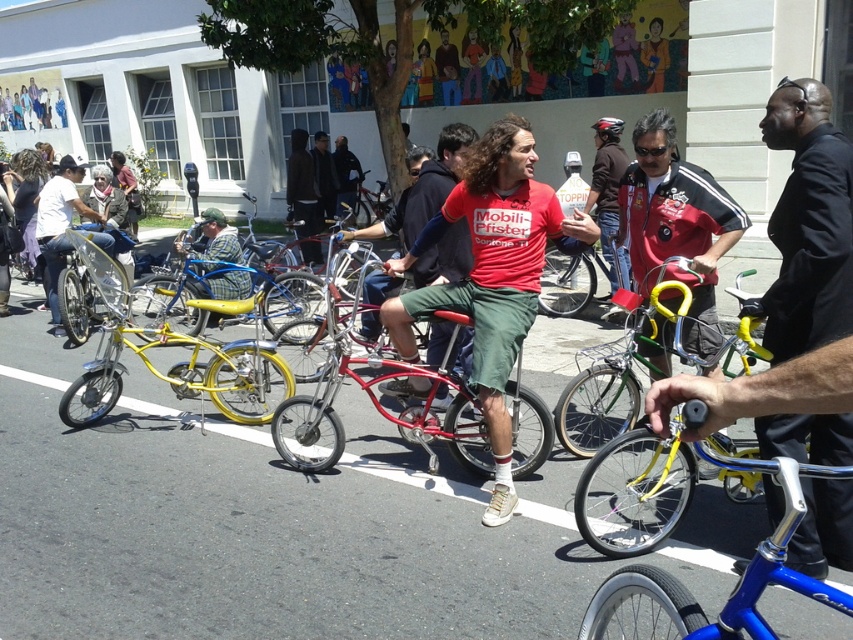
Question: Which of the following is the closest to the observer?

Choices:
 (A) blue metallic bicycle at center
 (B) matte yellow bicycle at left

Answer: (A)

Question: Which object is positioned farthest from the matte red t-shirt at center?

Choices:
 (A) blue metallic bicycle at center
 (B) shiny red bicycle at center
 (C) matte yellow bicycle at left
 (D) black suit jacket at center

Answer: (C)

Question: Which point is closer to the camera taking this photo?

Choices:
 (A) (457, 337)
 (B) (289, 419)
 (C) (619, 275)
 (D) (635, 400)

Answer: (D)

Question: Is black suit jacket at center above matte yellow bicycle at left?

Choices:
 (A) no
 (B) yes

Answer: (A)

Question: Is yellow metallic bicycle at center further to camera compared to matte red shirt at center?

Choices:
 (A) yes
 (B) no

Answer: (B)

Question: Does matte red t-shirt at center appear on the right side of yellow metallic bicycle at center?

Choices:
 (A) yes
 (B) no

Answer: (B)